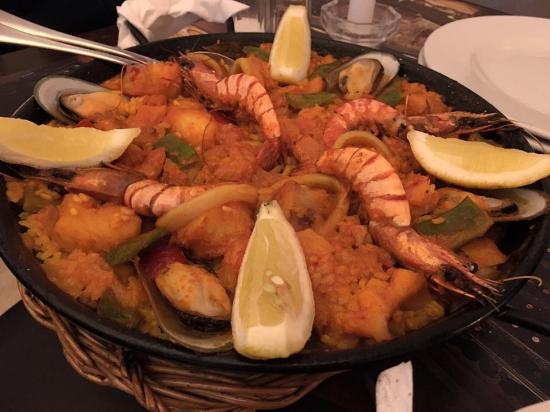
Find the location of a particular element. candle holder is located at coordinates (367, 23).